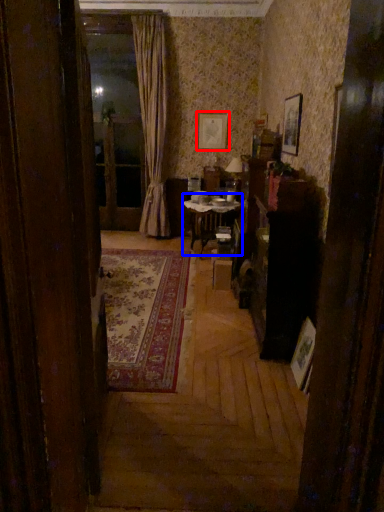
Question: Which object is closer to the camera taking this photo, picture frame (highlighted by a red box) or table (highlighted by a blue box)?

Choices:
 (A) picture frame
 (B) table

Answer: (B)